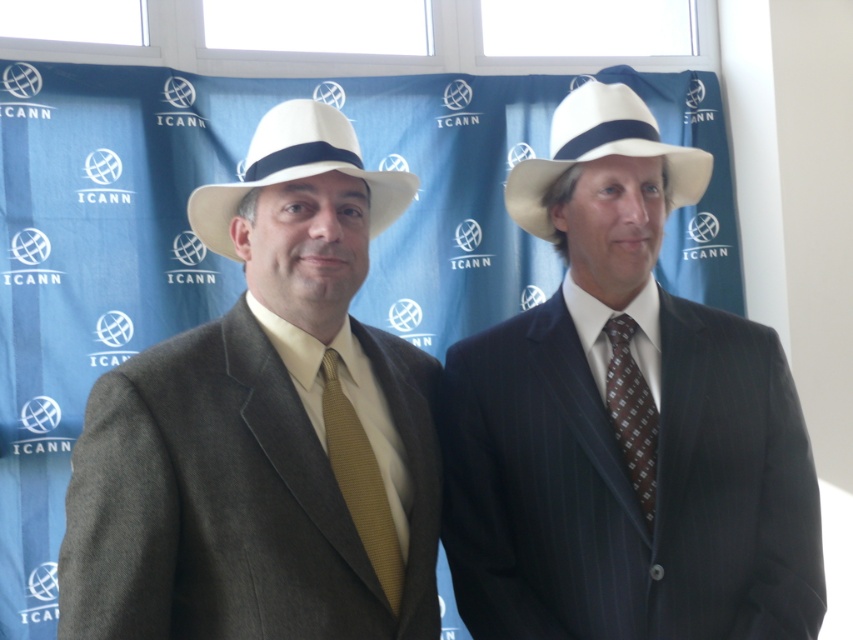
You are a photographer adjusting the camera settings for a portrait. You need to ensure that both the white felt fedora at upper right and the gold textured tie at center are in focus. Given that the camera can only maintain sharp focus within a 20 inch range, will both objects be in focus?

The white felt fedora at upper right is 22.11 inches away from the gold textured tie at center. Since the distance between them exceeds the camera focus range of 20 inches, the photographer cannot have both objects in focus simultaneously.

You are a photographer standing 6 feet away from the backdrop. You want to take a photo of the two men while ensuring the white felt fedora at center is in focus. Can you adjust your position so that both the men and the hat are in focus without moving the camera? Explain why or why not.

The white felt fedora at center and camera are 5.27 feet apart from each other. Since you are standing 6 feet away from the backdrop, the distance between you and the hat is within the camera focus range. Therefore, adjusting your position slightly closer or farther might keep both the men and the hat in focus, but it depends on the camera settings and depth of field. However, the exact distance between the camera and the hat is 5.27 feet, so if the camera can focus at that distance while maintaining the 6.